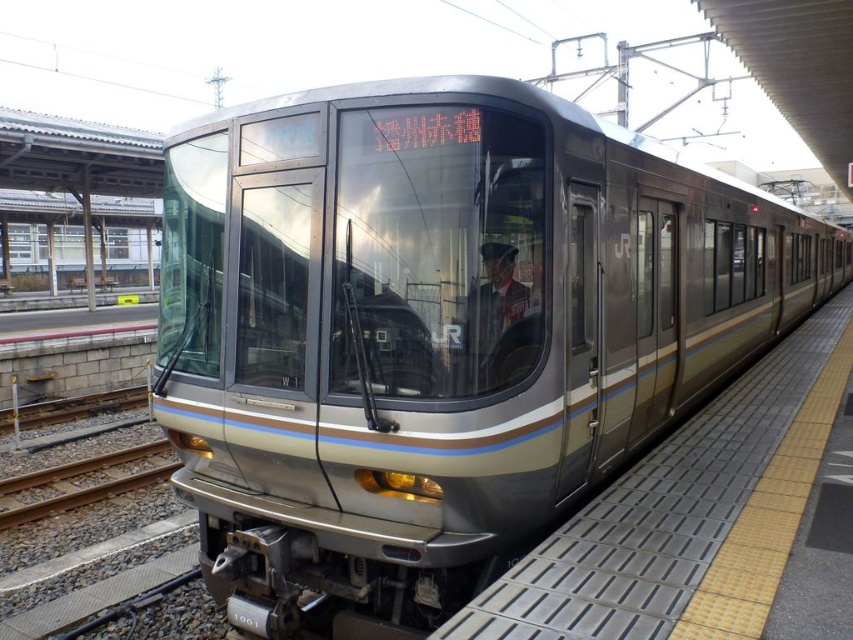
You are a passenger standing on the metallic gray platform at center and want to know if you can safely walk to the far end without stepping into the tracks. Considering the uniformed person at center is standing at the edge closest to the tracks, can you determine if the platform is wide enough for safe passage?

The metallic gray platform at center is wider than the uniformed person at center, so yes, the platform is wide enough for safe passage as the platform extends beyond the person standing at the edge.